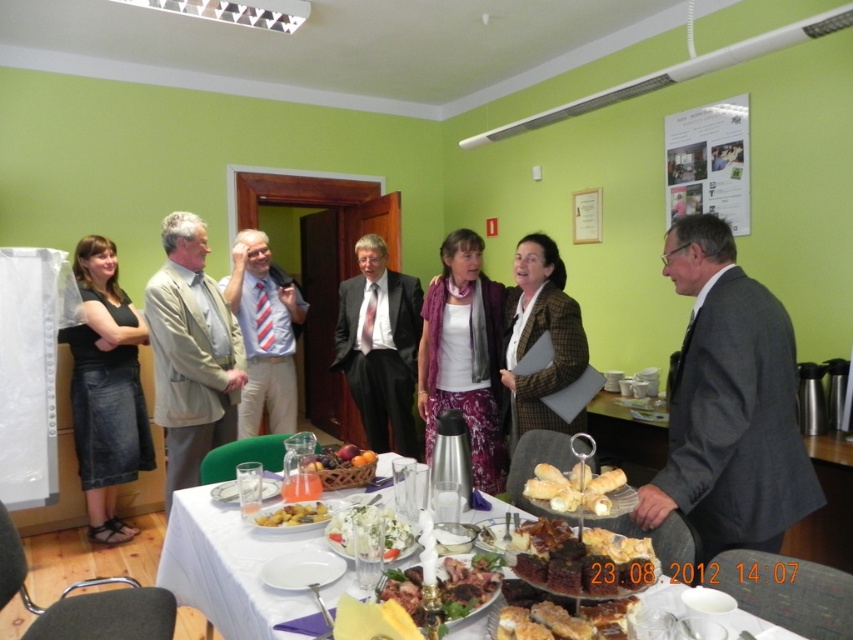
Which is behind, point (283, 372) or point (601, 508)?

The point (283, 372) is behind.

Which is in front, point (277, 273) or point (564, 474)?

Point (564, 474)

Identify the location of matte blue shirt at center. This screenshot has width=853, height=640. (264, 333).

Which is in front, point (190, 353) or point (289, 525)?

Point (289, 525) is more forward.

Which of these two, light beige fabric suit at center or golden fried potatoes at center, stands shorter?

With less height is golden fried potatoes at center.

Is point (196, 224) more distant than point (305, 513)?

Yes.

I want to click on light beige fabric suit at center, so click(x=190, y=353).

Who is more forward, (x=305, y=593) or (x=573, y=493)?

Point (x=573, y=493) is more forward.

Who is lower down, white porcelain table at center or golden crispy pastry at center?

white porcelain table at center is below.

Which is in front, point (262, 630) or point (567, 480)?

Point (567, 480)

Where is `white porcelain table at center`? white porcelain table at center is located at coordinates (228, 566).